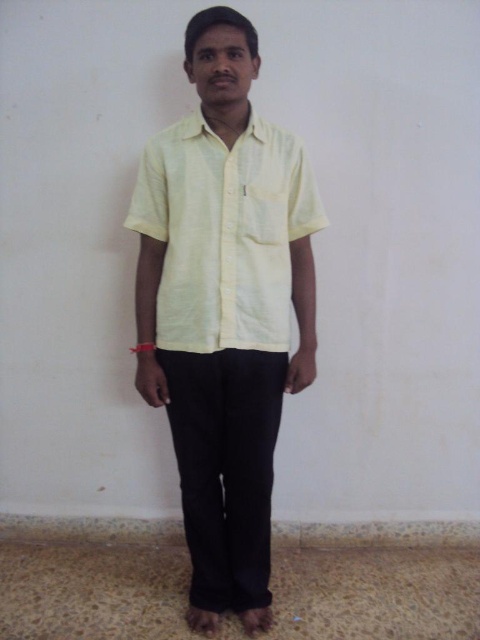
You are a photographer adjusting your camera settings. You notice two points marked in the scene. The first point is at coordinates point (x=178, y=236), and the second point is at point (x=192, y=326). Which of these two points is closer to you?

Point (x=178, y=236) is closer to the viewer than point (x=192, y=326).

You are a fashion stylist trying to determine the spatial arrangement of the clothing items in the image. According to the scene, where is the light yellow linen shirt at center relative to the black cotton pants at center?

The light yellow linen shirt at center is to the right of the black cotton pants at center.